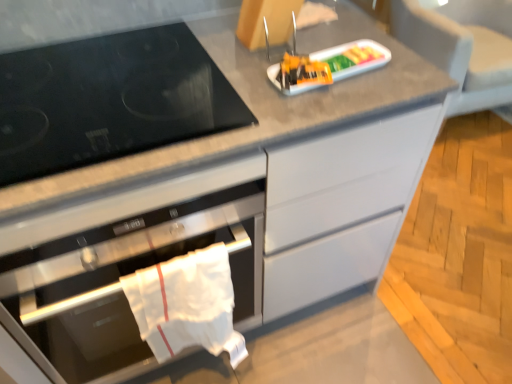
The height and width of the screenshot is (384, 512). Find the location of `vacant area that is in front of plastic tray at center`. vacant area that is in front of plastic tray at center is located at coordinates (325, 101).